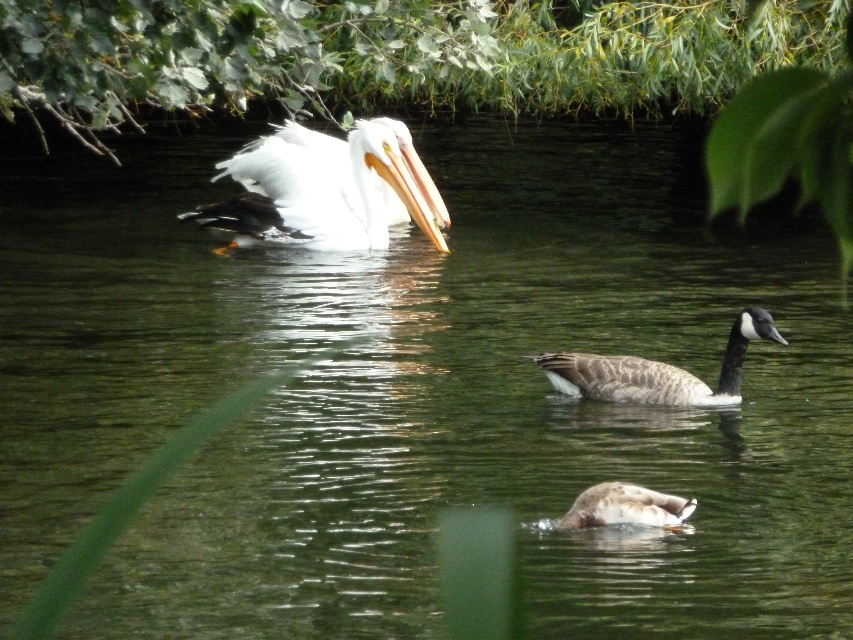
Is brown speckled goose at center thinner than brown matte duck at center?

In fact, brown speckled goose at center might be wider than brown matte duck at center.

Who is more forward, (747,310) or (636,492)?

Point (636,492) is more forward.

Locate an element on the screen. brown speckled goose at center is located at coordinates (657, 371).

Which is above, white glossy pelican at upper left or brown matte duck at center?

white glossy pelican at upper left is higher up.

The height and width of the screenshot is (640, 853). What do you see at coordinates (317, 193) in the screenshot?
I see `white glossy pelican at upper left` at bounding box center [317, 193].

Is point (251, 189) closer to viewer compared to point (625, 486)?

No, (251, 189) is further to viewer.

Locate an element on the screen. white glossy pelican at upper left is located at coordinates (317, 193).

Does white glossy pelican at upper left have a greater width compared to brown speckled goose at center?

Indeed, white glossy pelican at upper left has a greater width compared to brown speckled goose at center.

Between white glossy pelican at upper left and brown speckled goose at center, which one is positioned lower?

Positioned lower is brown speckled goose at center.

Is point (300, 186) in front of point (728, 401)?

No, it is behind (728, 401).

In order to click on white glossy pelican at upper left in this screenshot , I will do `click(317, 193)`.